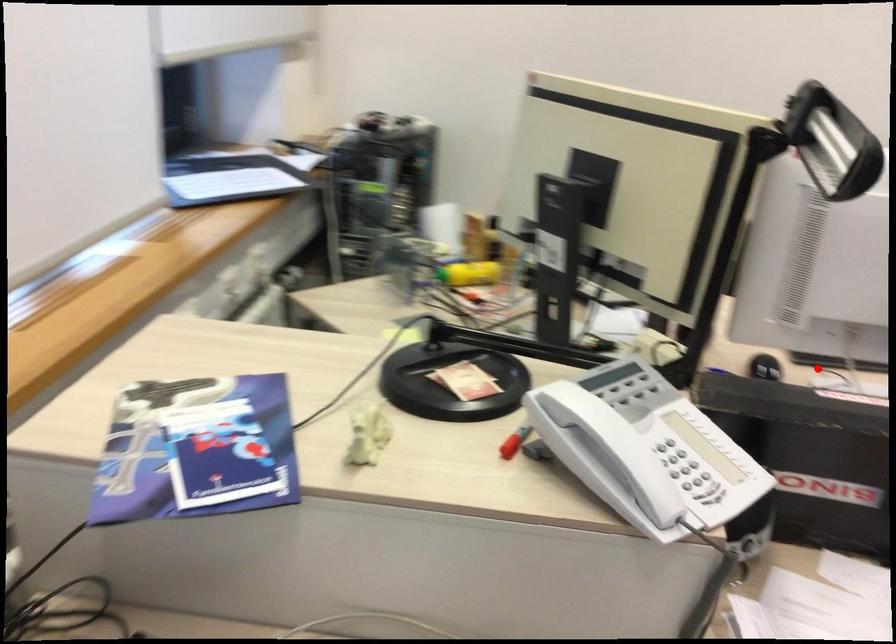
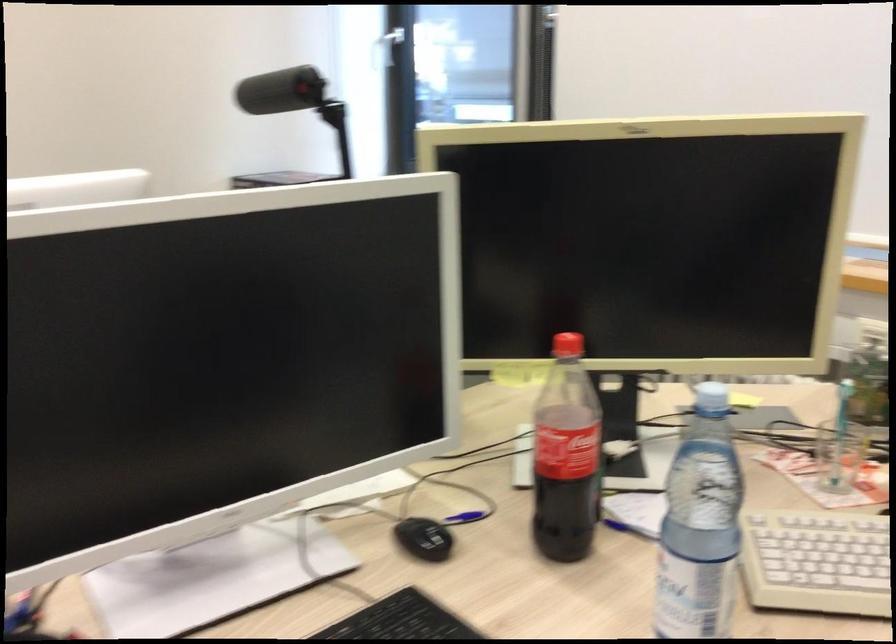
Question: I am providing you with two images of the same scene from different viewpoints. A red point is shown in image1. For the corresponding object point in image2, is it positioned nearer or farther from the camera?

Choices:
 (A) Nearer
 (B) Farther

Answer: (A)